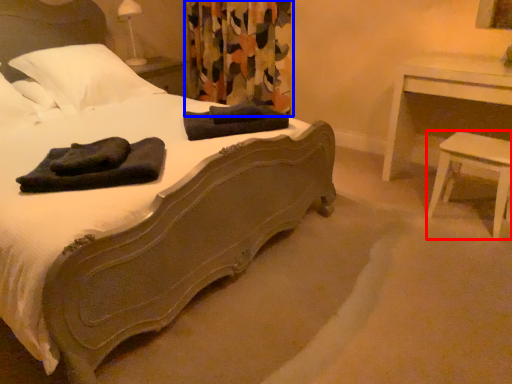
Question: Which object appears closest to the camera in this image, stool (highlighted by a red box) or curtain (highlighted by a blue box)?

Choices:
 (A) stool
 (B) curtain

Answer: (A)